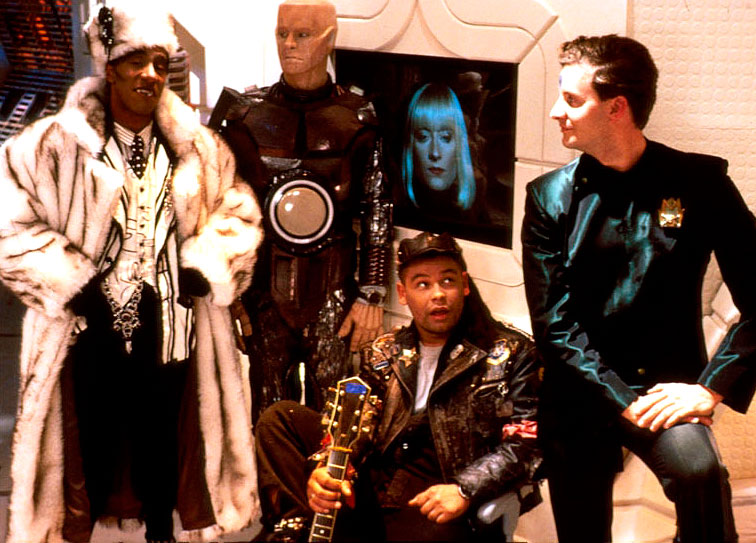
Where is `circles on the wall`? This screenshot has height=543, width=756. circles on the wall is located at coordinates (722, 66).